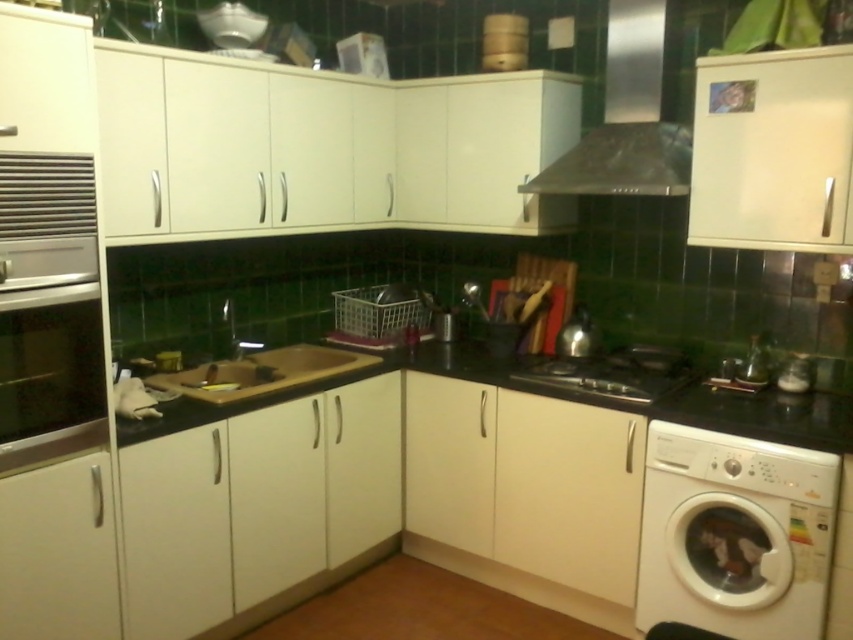
Which is in front, point (531, 387) or point (650, 24)?

Point (650, 24) is in front.

Measure the distance between black matte countertop at center and camera.

They are 2.06 meters apart.

Locate an element on the screen. The width and height of the screenshot is (853, 640). black matte countertop at center is located at coordinates (572, 400).

Between white glossy cabinet at upper center and brown matte cutting board at center, which one has less height?

brown matte cutting board at center

Is white glossy cabinet at upper center bigger than brown matte cutting board at center?

Correct, white glossy cabinet at upper center is larger in size than brown matte cutting board at center.

Describe the element at coordinates (322, 145) in the screenshot. I see `white glossy cabinet at upper center` at that location.

Where is `white glossy cabinet at upper center`? The height and width of the screenshot is (640, 853). white glossy cabinet at upper center is located at coordinates tap(322, 145).

Can you confirm if stainless steel exhaust hood at upper center is shorter than stainless steel stove at center?

Incorrect, stainless steel exhaust hood at upper center's height does not fall short of stainless steel stove at center's.

Does stainless steel exhaust hood at upper center have a larger size compared to stainless steel stove at center?

Yes, stainless steel exhaust hood at upper center is bigger than stainless steel stove at center.

Is point (577, 161) more distant than point (608, 372)?

No.

The height and width of the screenshot is (640, 853). Find the location of `stainless steel exhaust hood at upper center`. stainless steel exhaust hood at upper center is located at coordinates (625, 120).